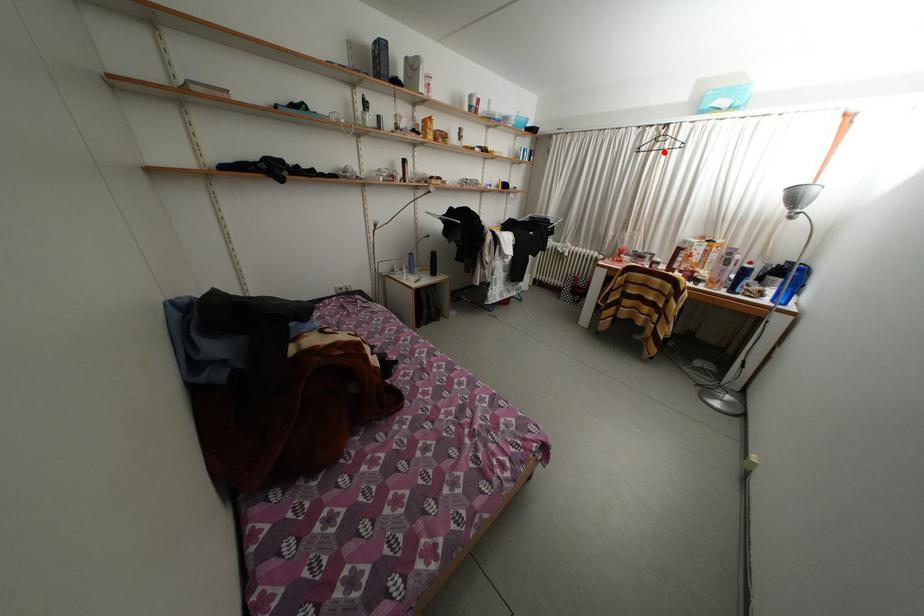
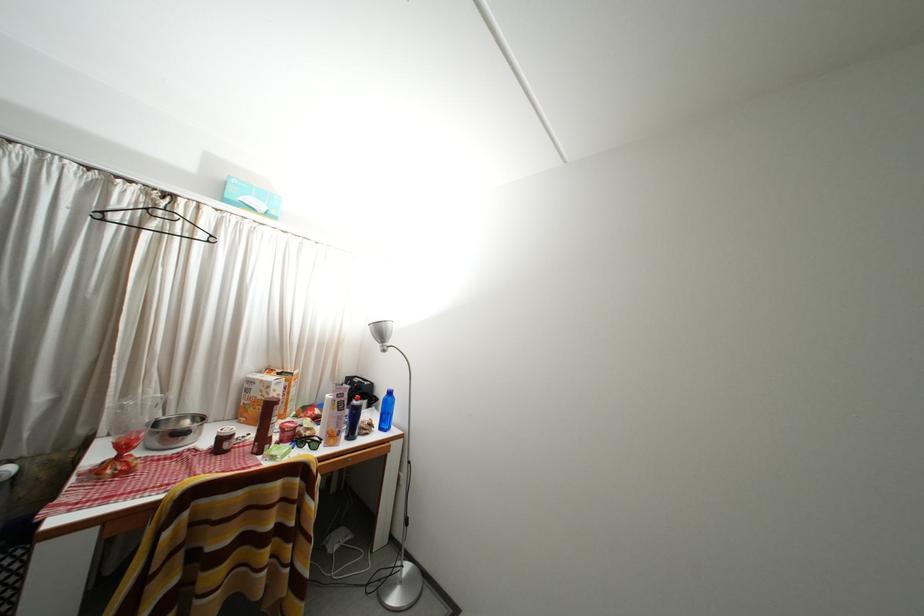
In the second image, find the point that corresponds to the highlighted location in the first image.

(161, 230)